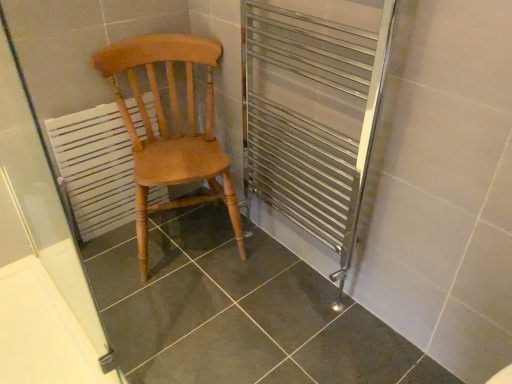
At what (x,y) coordinates should I click in order to perform the action: click on free spot in front of light brown wood chair at center. Please return your answer as a coordinate pair (x, y). The image size is (512, 384). Looking at the image, I should click on click(x=169, y=316).